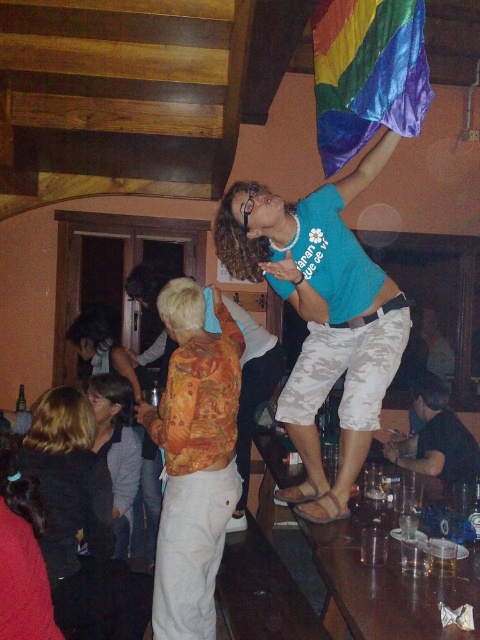
Is orange printed shirt at center further to camera compared to rainbow satin flag at upper right?

Yes, orange printed shirt at center is further from the viewer.

Between orange printed shirt at center and rainbow satin flag at upper right, which one appears on the left side from the viewer's perspective?

Positioned to the left is orange printed shirt at center.

Between point (173, 310) and point (346, 44), which one is positioned behind?

Positioned behind is point (173, 310).

At what (x,y) coordinates should I click in order to perform the action: click on orange printed shirt at center. Please return your answer as a coordinate pair (x, y). Looking at the image, I should click on (193, 460).

Is rainbow satin flag at upper right thinner than matte gray shirt at lower left?

Correct, rainbow satin flag at upper right's width is less than matte gray shirt at lower left's.

Where is `rainbow satin flag at upper right`? Image resolution: width=480 pixels, height=640 pixels. rainbow satin flag at upper right is located at coordinates (367, 74).

Identify the location of rainbow satin flag at upper right. (367, 74).

Is point (346, 273) farther from viewer compared to point (204, 330)?

No, it is not.

This screenshot has height=640, width=480. I want to click on blue t-shirt at upper center, so click(312, 305).